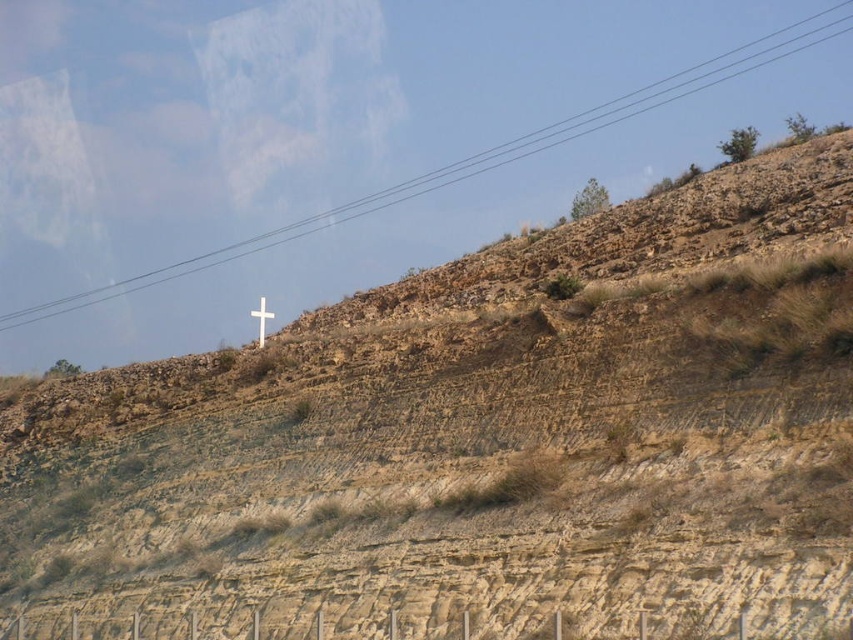
Is black wire at upper center closer to the viewer compared to white wooden cross at upper center?

No, it is not.

Does black wire at upper center have a smaller size compared to white wooden cross at upper center?

No.

Is point (625, 118) closer to viewer compared to point (258, 314)?

That is False.

I want to click on black wire at upper center, so click(x=480, y=157).